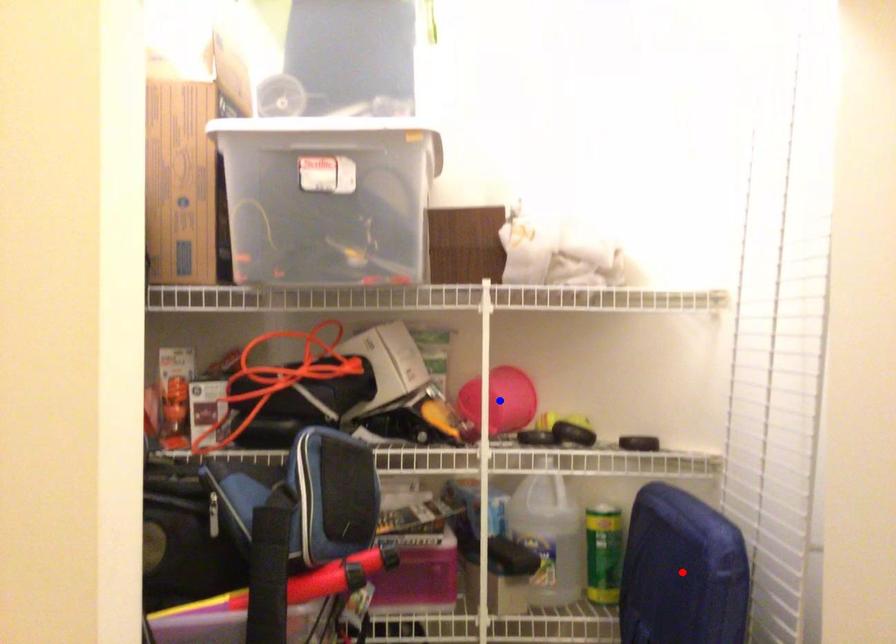
Question: In the image, two points are highlighted. Which point is nearer to the camera? Reply with the corresponding letter.

Choices:
 (A) blue point
 (B) red point

Answer: (B)